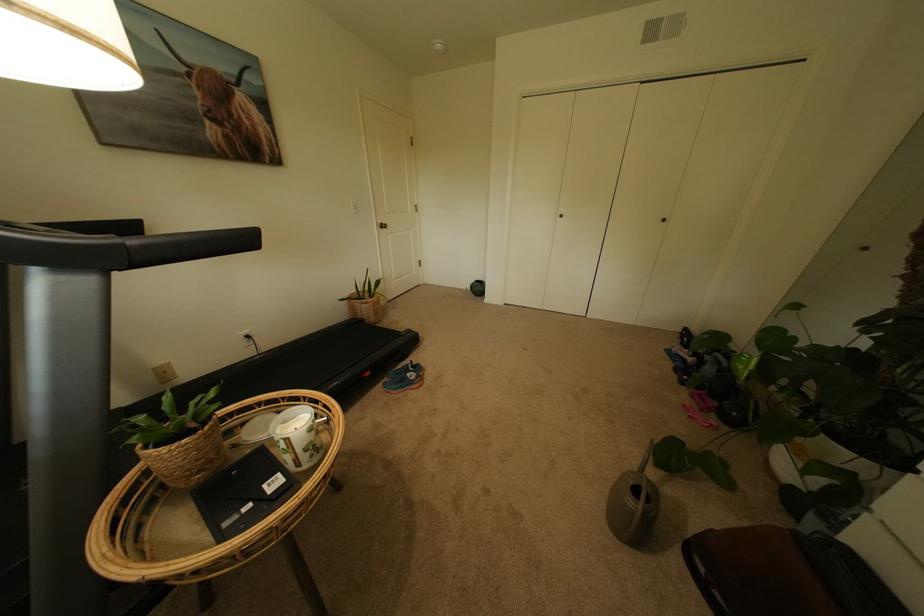
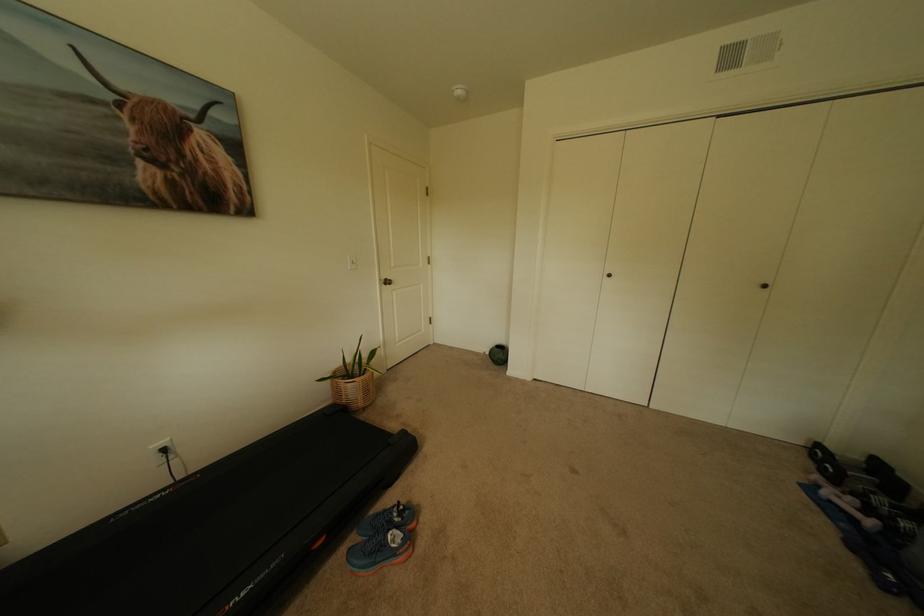
In the second image, find the point that corresponds to pixel 257 338 in the first image.

(173, 451)